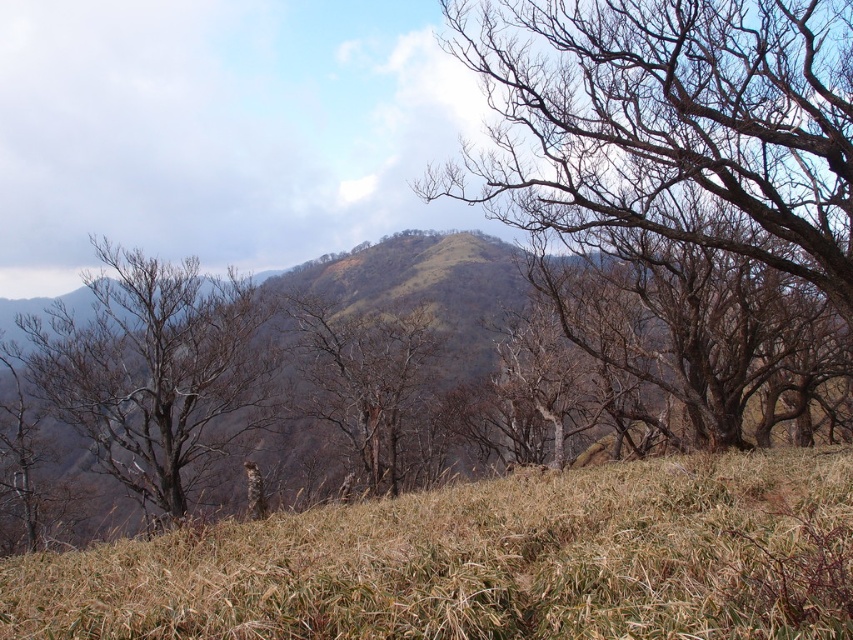
Is brown dry grass at lower center shorter than brown/dry bark tree at upper right?

Indeed, brown dry grass at lower center has a lesser height compared to brown/dry bark tree at upper right.

Which is below, brown dry grass at lower center or brown/dry bark tree at upper right?

brown dry grass at lower center

At what (x,y) coordinates should I click in order to perform the action: click on brown dry grass at lower center. Please return your answer as a coordinate pair (x, y). Looking at the image, I should click on (486, 563).

Does brown/dry bark tree at upper right appear over brown matte tree at center?

Yes.

Is brown/dry bark tree at upper right taller than brown matte tree at center?

Yes, brown/dry bark tree at upper right is taller than brown matte tree at center.

Who is more distant from viewer, (645, 145) or (364, 436)?

The point (364, 436) is behind.

What are the coordinates of `brown/dry bark tree at upper right` in the screenshot? It's located at (666, 128).

Is brown/dry bark tree at upper right to the right of bare branches at left from the viewer's perspective?

Indeed, brown/dry bark tree at upper right is positioned on the right side of bare branches at left.

This screenshot has width=853, height=640. I want to click on brown/dry bark tree at upper right, so click(666, 128).

You are a GUI agent. You are given a task and a screenshot of the screen. Output one action in this format:
    pyautogui.click(x=<x>, y=<y>)
    Task: Click on the brown/dry bark tree at upper right
    
    Given the screenshot: What is the action you would take?
    666,128